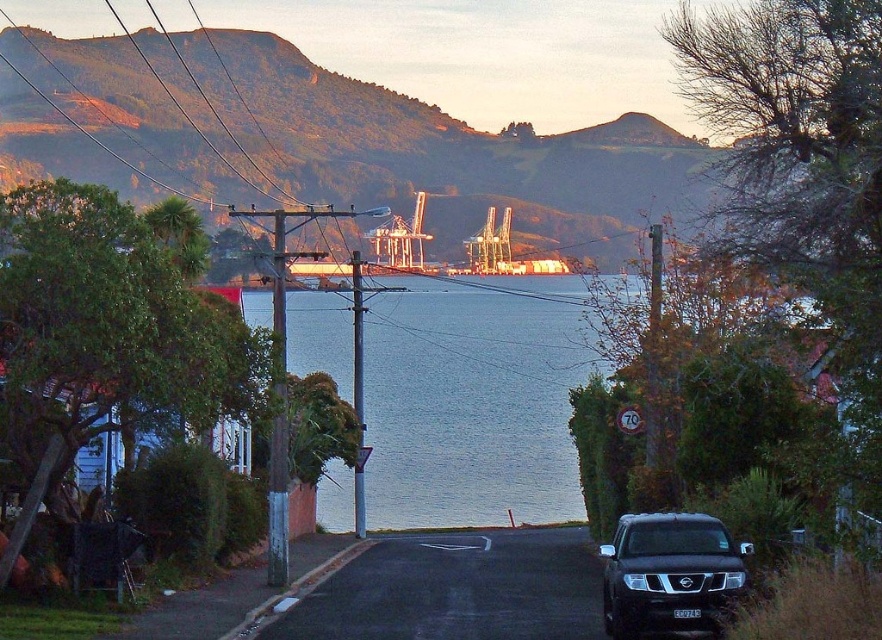
Is point (567, 154) closer to camera compared to point (741, 579)?

No.

Does green textured mountain at upper center have a lesser height compared to satin black suv at lower right?

In fact, green textured mountain at upper center may be taller than satin black suv at lower right.

Who is more forward, (60, 145) or (611, 541)?

Positioned in front is point (611, 541).

You are a GUI agent. You are given a task and a screenshot of the screen. Output one action in this format:
    pyautogui.click(x=<x>, y=<y>)
    Task: Click on the green textured mountain at upper center
    
    Given the screenshot: What is the action you would take?
    pyautogui.click(x=322, y=138)

The width and height of the screenshot is (882, 640). What do you see at coordinates (473, 400) in the screenshot?
I see `blue water at center` at bounding box center [473, 400].

Which is behind, point (387, 310) or point (651, 556)?

The point (387, 310) is behind.

In order to click on blue water at center in this screenshot , I will do `click(473, 400)`.

Can you confirm if green textured mountain at upper center is bigger than blue water at center?

Yes.

Which is more to the right, green textured mountain at upper center or blue water at center?

blue water at center is more to the right.

The image size is (882, 640). I want to click on green textured mountain at upper center, so click(322, 138).

This screenshot has width=882, height=640. Identify the location of green textured mountain at upper center. (322, 138).